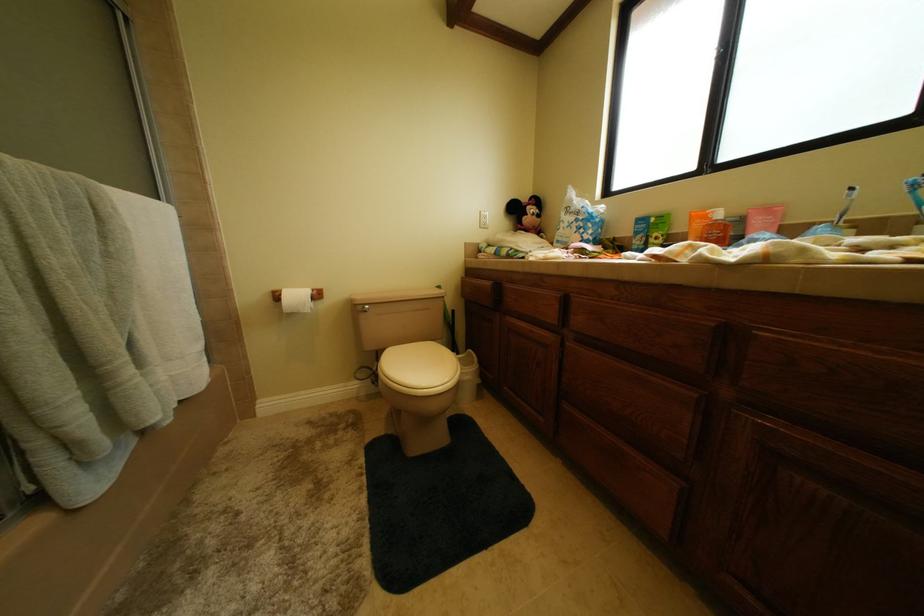
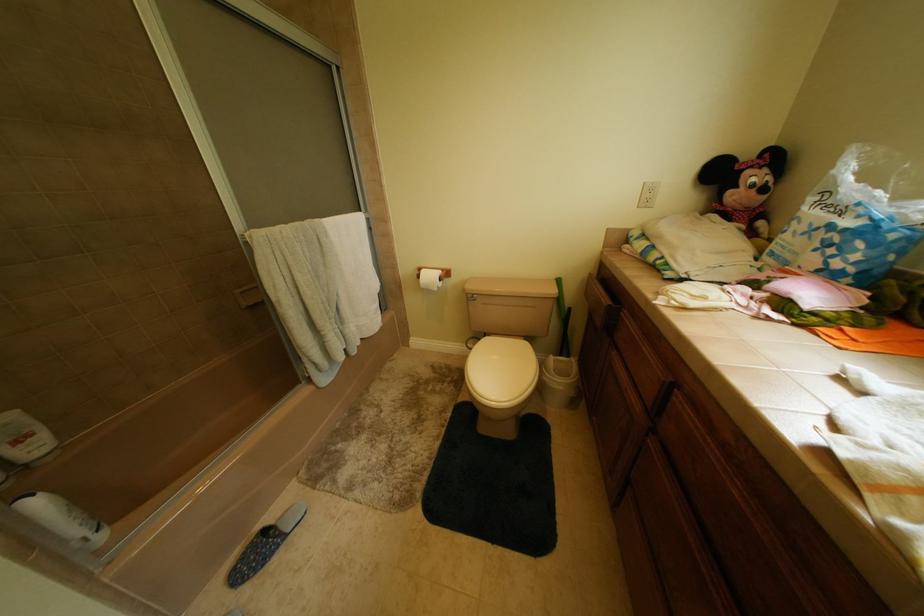
The first image is from the beginning of the video and the second image is from the end. How did the camera likely rotate when shooting the video?

The camera's rotation is toward left-down.